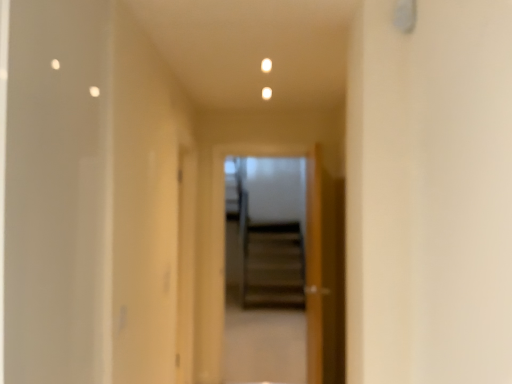
Question: Is transparent glass screen door at center next to wooden door at center and touching it?

Choices:
 (A) no
 (B) yes

Answer: (A)

Question: Could you tell me if transparent glass screen door at center is facing wooden door at center?

Choices:
 (A) no
 (B) yes

Answer: (A)

Question: Is transparent glass screen door at center to the right of wooden door at center from the viewer's perspective?

Choices:
 (A) no
 (B) yes

Answer: (A)

Question: From the image's perspective, does transparent glass screen door at center appear higher than wooden door at center?

Choices:
 (A) no
 (B) yes

Answer: (B)

Question: Can you confirm if transparent glass screen door at center is taller than wooden door at center?

Choices:
 (A) yes
 (B) no

Answer: (A)

Question: From a real-world perspective, is transparent glass screen door at center beneath wooden door at center?

Choices:
 (A) no
 (B) yes

Answer: (A)

Question: Considering the relative sizes of wooden door at center and transparent glass screen door at center in the image provided, is wooden door at center taller than transparent glass screen door at center?

Choices:
 (A) no
 (B) yes

Answer: (A)

Question: From a real-world perspective, is wooden door at center below transparent glass screen door at center?

Choices:
 (A) yes
 (B) no

Answer: (A)

Question: Is wooden door at center not close to transparent glass screen door at center?

Choices:
 (A) no
 (B) yes

Answer: (B)

Question: From the image's perspective, is wooden door at center located beneath transparent glass screen door at center?

Choices:
 (A) no
 (B) yes

Answer: (B)

Question: Is wooden door at center surrounding transparent glass screen door at center?

Choices:
 (A) yes
 (B) no

Answer: (B)

Question: From the image's perspective, does wooden door at center appear higher than transparent glass screen door at center?

Choices:
 (A) no
 (B) yes

Answer: (A)

Question: Considering the positions of transparent glass screen door at center and wooden door at center in the image, is transparent glass screen door at center bigger or smaller than wooden door at center?

Choices:
 (A) big
 (B) small

Answer: (B)